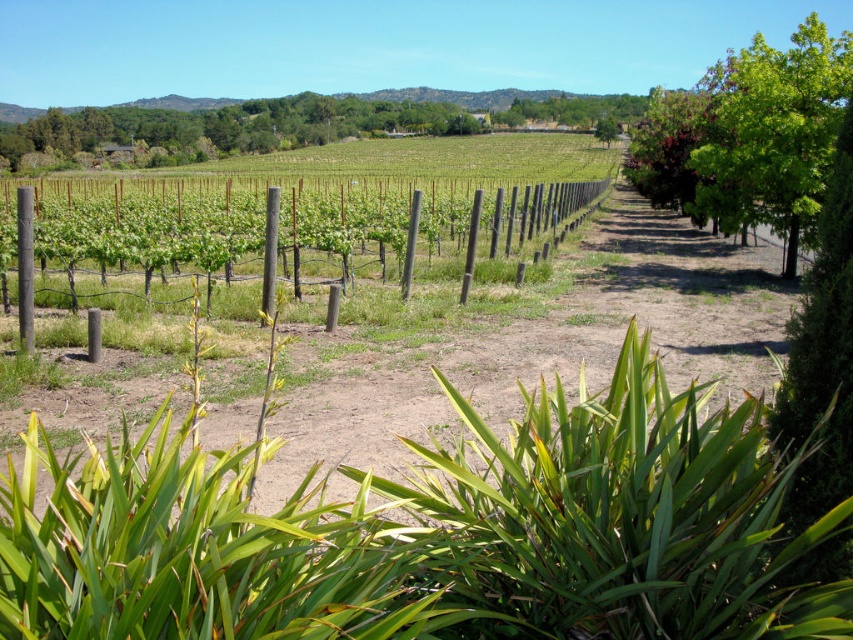
You are planning to plant a new tree in the vineyard. The green leafy tree at right has a width of 2 meters. The green leafy tree at upper center is wider. If you want to plant a tree that is 3 meters wide, which existing tree in the scene can it fit next to without overlapping?

The green leafy tree at upper center is wider than the green leafy tree at right. Since the new tree is 3 meters wide, it can fit next to the green leafy tree at upper center because it has more space available compared to the narrower tree at right.

In the scene shown: You are standing at the entrance of the vineyard and see the green leafy tree at right and the green leafy tree at upper center. Which tree is closer to the ground?

The green leafy tree at right is located below green leafy tree at upper center, so it is closer to the ground.